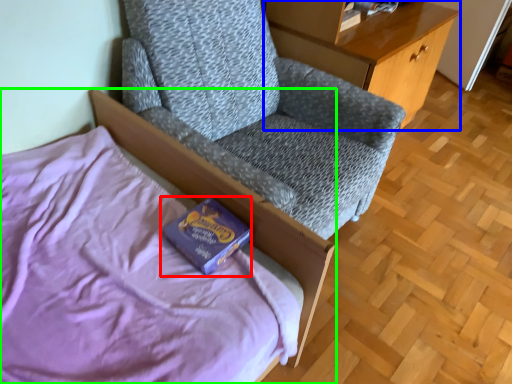
Question: Which is farther away from paperback book (highlighted by a red box)? desk (highlighted by a blue box) or bed (highlighted by a green box)?

Choices:
 (A) desk
 (B) bed

Answer: (A)